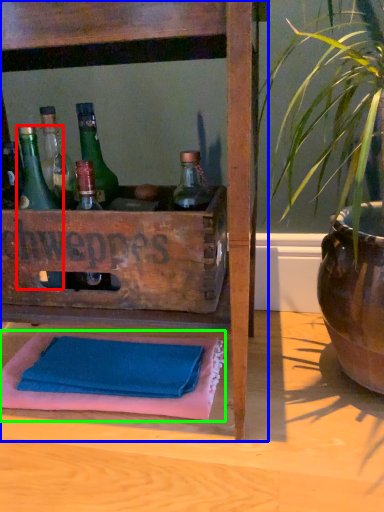
Question: Which is nearer to the bottle (highlighted by a red box)? furniture (highlighted by a blue box) or bath towel (highlighted by a green box).

Choices:
 (A) furniture
 (B) bath towel

Answer: (A)